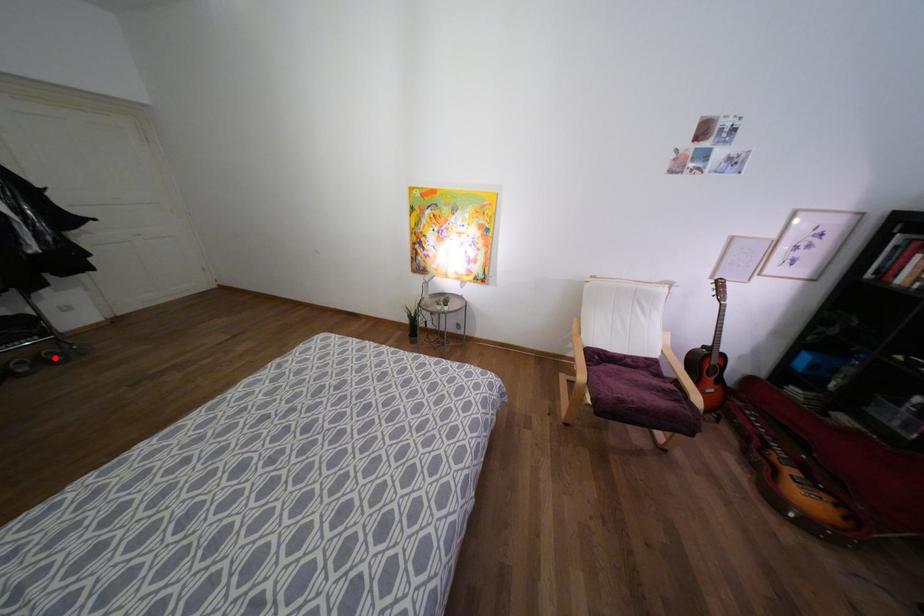
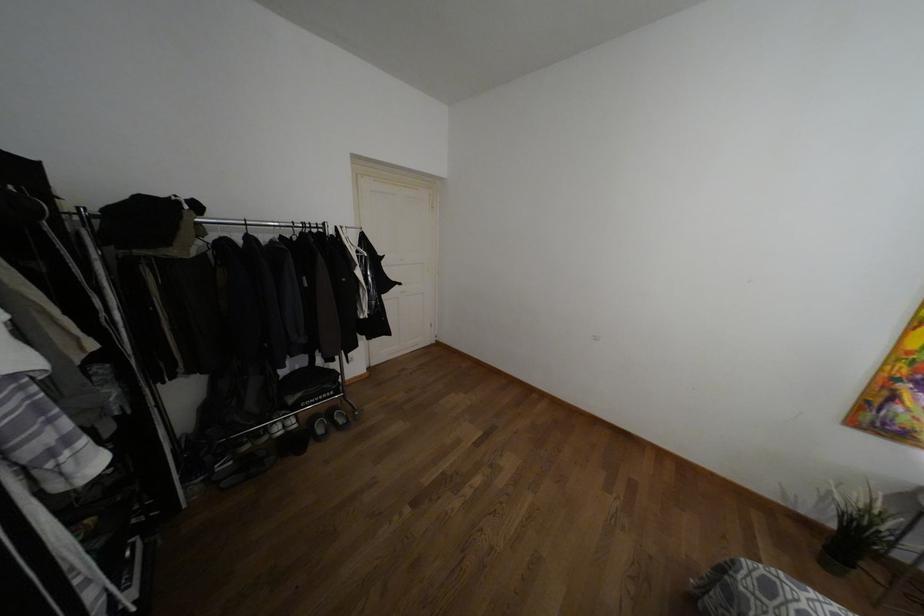
Question: A red point is marked in image1. In image2, is the corresponding 3D point closer to the camera or farther? Reply with the corresponding letter.

Choices:
 (A) The corresponding 3D point is closer.
 (B) The corresponding 3D point is farther.

Answer: (B)